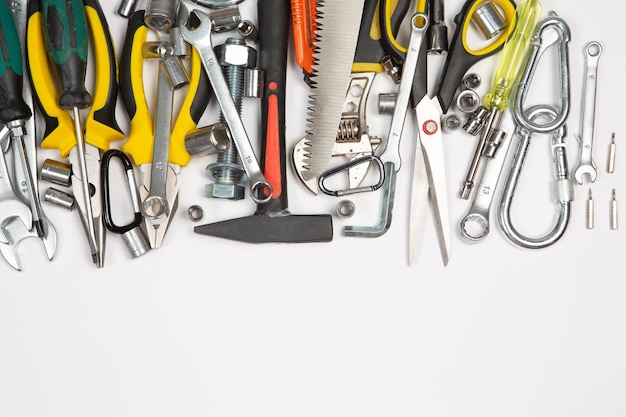
Find the location of a particular element. large socket is located at coordinates (160, 11), (210, 134), (484, 19).